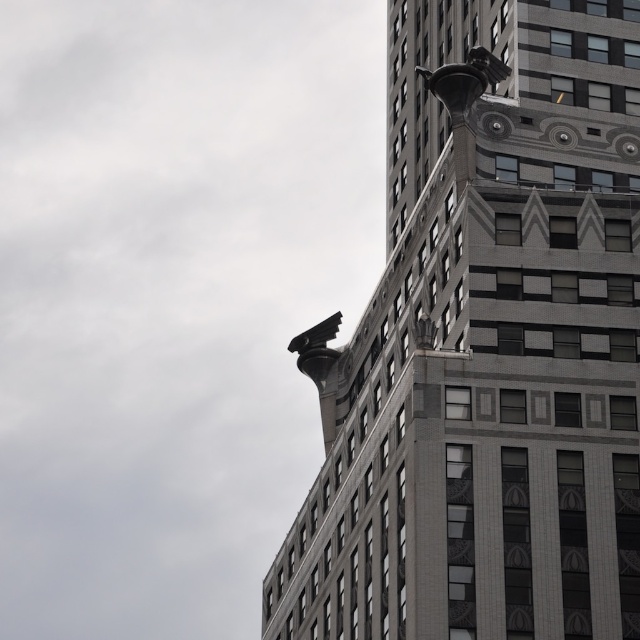
Is gray stone eagle at upper right to the left of dark gray stone gargoyle at upper center from the viewer's perspective?

Correct, you'll find gray stone eagle at upper right to the left of dark gray stone gargoyle at upper center.

The width and height of the screenshot is (640, 640). Find the location of `gray stone eagle at upper right`. gray stone eagle at upper right is located at coordinates (486, 352).

Which is in front, point (449, 493) or point (456, 109)?

Point (449, 493) is in front.

This screenshot has width=640, height=640. Find the location of `gray stone eagle at upper right`. gray stone eagle at upper right is located at coordinates (486, 352).